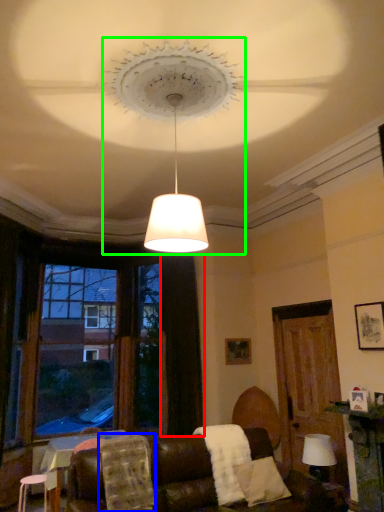
Question: Estimate the real-world distances between objects in this image. Which object is closer to curtain (highlighted by a red box), blanket (highlighted by a blue box) or lighting (highlighted by a green box)?

Choices:
 (A) blanket
 (B) lighting

Answer: (A)